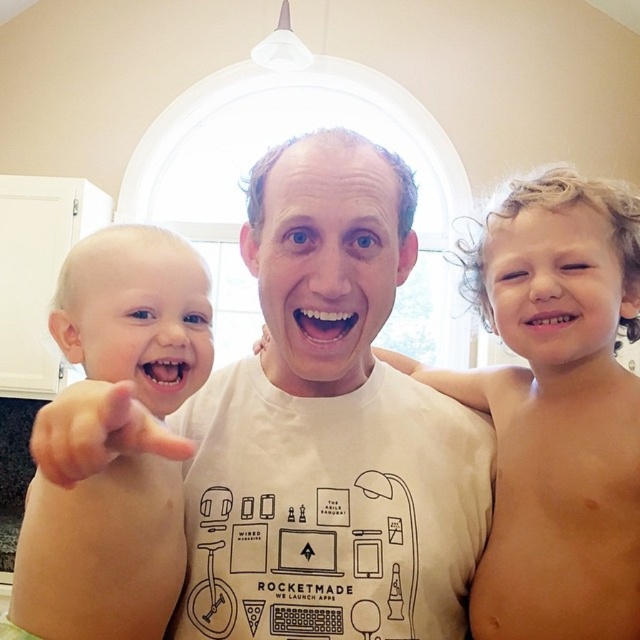
You are a photographer trying to capture the perfect shot of the scene. You notice two points in the image at coordinates point (406, 573) and point (166, 342). Which point is closer to you?

Point (406, 573) is further to the viewer than point (166, 342), so the closer point to you is point (166, 342).